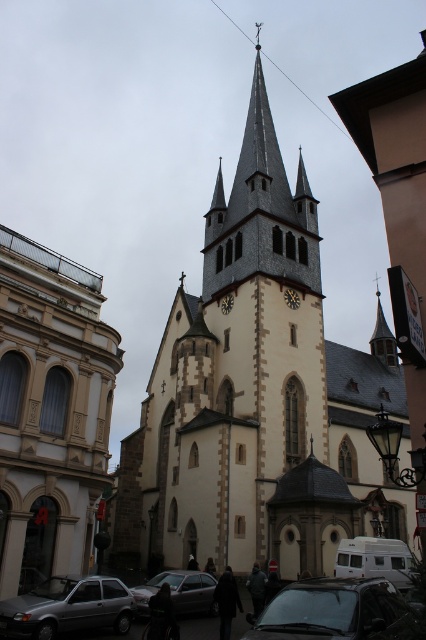
You are a photographer standing at the lower right of the image. You want to capture both the beige stone church at center and the silver metallic sedan at lower center in a single photo. Which object should you focus on first to ensure both are in frame?

The beige stone church at center is bigger than the silver metallic sedan at lower center, so you should focus on the beige stone church at center first to ensure both fit within the frame.

You are a photographer standing at the bottom of the hill. You want to capture the beige stone church at center and the silver metallic sedan at lower center in a single photo. Considering their heights, which object will appear larger in the photo?

The beige stone church at center will appear larger in the photo because it has a greater height compared to the silver metallic sedan at lower center.

You are standing in front of the historic church and notice two points marked on the facade. The first point is at coordinate point(190, 362) and the second is at point(296, 301). Which of these two points is closer to you?

Point(190, 362) is in front of point(296, 301), so it is closer to you.